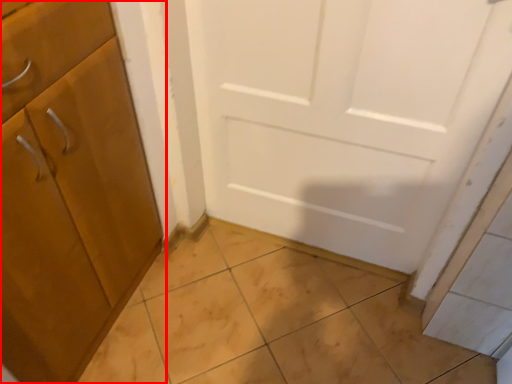
Question: Observing the image, what is the correct spatial positioning of cabinetry (annotated by the red box) in reference to tile?

Choices:
 (A) right
 (B) left

Answer: (B)